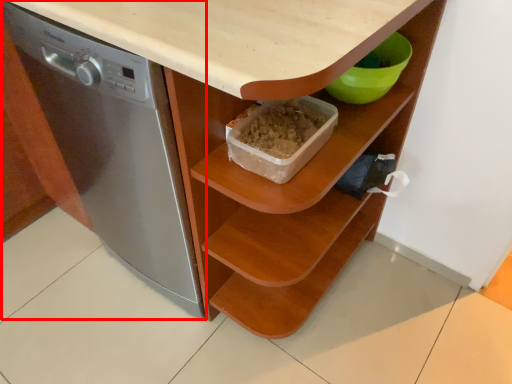
Question: From the image's perspective, what is the correct spatial positioning of home appliance (annotated by the red box) in reference to shelf?

Choices:
 (A) above
 (B) below

Answer: (A)